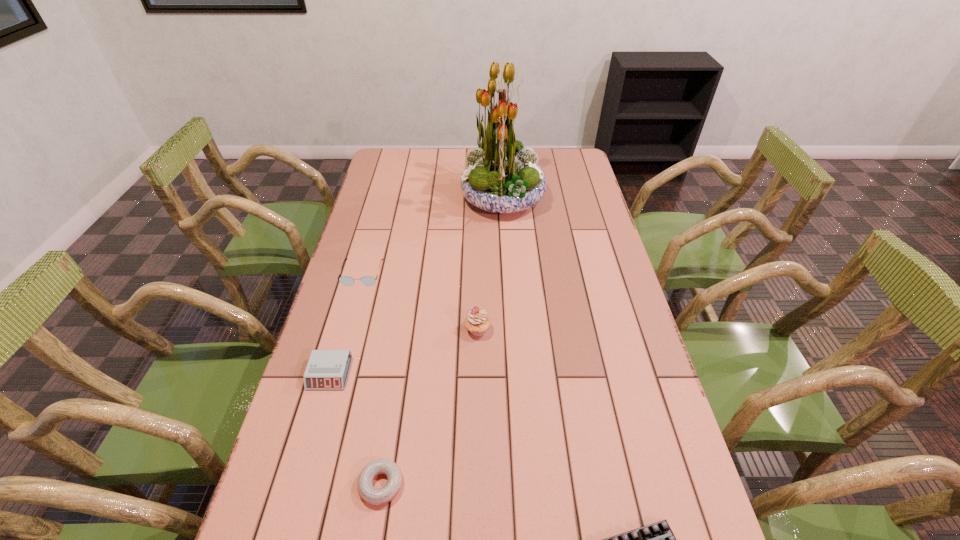
In the image, there is a desktop. Find the location of `free space at the far left corner`. free space at the far left corner is located at coordinates (417, 151).

In the image, there is a desktop. At what (x,y) coordinates should I click in order to perform the action: click on free space at the far right corner. Please return your answer as a coordinate pair (x, y). Image resolution: width=960 pixels, height=540 pixels. Looking at the image, I should click on (581, 157).

The height and width of the screenshot is (540, 960). In order to click on free spot between the fifth shortest object and the fifth nearest object in this screenshot , I will do `click(420, 301)`.

This screenshot has width=960, height=540. I want to click on vacant region between the fourth farthest object and the second nearest object, so click(x=355, y=429).

Identify the location of vacant area that lies between the cupcake and the alarm clock. The height and width of the screenshot is (540, 960). (403, 352).

At what (x,y) coordinates should I click in order to perform the action: click on vacant region between the doughnut and the third nearest object. Please return your answer as a coordinate pair (x, y). The height and width of the screenshot is (540, 960). Looking at the image, I should click on (355, 429).

Where is `empty space that is in between the third nearest object and the third farthest object`? The height and width of the screenshot is (540, 960). empty space that is in between the third nearest object and the third farthest object is located at coordinates (403, 352).

Locate an element on the screen. blank region between the farthest object and the second farthest object is located at coordinates (432, 237).

The image size is (960, 540). What are the coordinates of `vacant region between the alarm clock and the tallest object` in the screenshot? It's located at (416, 286).

Locate which object ranks fourth in proximity to the fourth nearest object. Please provide its 2D coordinates. Your answer should be formatted as a tuple, i.e. [(x, y)], where the tuple contains the x and y coordinates of a point satisfying the conditions above.

[(501, 176)]